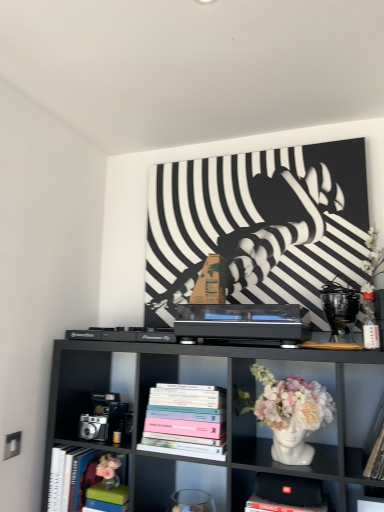
Question: Considering the relative positions of hardcover book at left, positioned as the first book in bottom-to-top order, and white glossy vase at center in the image provided, is hardcover book at left, positioned as the first book in bottom-to-top order, to the right of white glossy vase at center from the viewer's perspective?

Choices:
 (A) no
 (B) yes

Answer: (A)

Question: From a real-world perspective, is hardcover book at left, positioned as the first book in bottom-to-top order, located higher than white glossy vase at center?

Choices:
 (A) no
 (B) yes

Answer: (A)

Question: Does hardcover book at left, placed as the 1th book when sorted from left to right, touch white glossy vase at center?

Choices:
 (A) yes
 (B) no

Answer: (B)

Question: Is hardcover book at left, positioned as the first book in bottom-to-top order, at the left side of white glossy vase at center?

Choices:
 (A) no
 (B) yes

Answer: (B)

Question: Considering the relative sizes of hardcover book at left, the second book in the top-to-bottom sequence, and white glossy vase at center in the image provided, is hardcover book at left, the second book in the top-to-bottom sequence, smaller than white glossy vase at center?

Choices:
 (A) yes
 (B) no

Answer: (A)

Question: Would you consider hardcover book at left, the second book in the top-to-bottom sequence, to be distant from white glossy vase at center?

Choices:
 (A) no
 (B) yes

Answer: (A)

Question: From a real-world perspective, is hardcover book at left, the second book in the top-to-bottom sequence, located beneath black fabric speaker at lower center, which is counted as the first shelf, starting from the bottom?

Choices:
 (A) no
 (B) yes

Answer: (A)

Question: Is hardcover book at left, the second book in the top-to-bottom sequence, looking in the opposite direction of black fabric speaker at lower center, which ranks as the 2th shelf in top-to-bottom order?

Choices:
 (A) no
 (B) yes

Answer: (A)

Question: Does hardcover book at left, placed as the 1th book when sorted from left to right, appear on the left side of black fabric speaker at lower center, which ranks as the 2th shelf in top-to-bottom order?

Choices:
 (A) no
 (B) yes

Answer: (B)

Question: Is hardcover book at left, placed as the 1th book when sorted from left to right, wider than black fabric speaker at lower center, which ranks as the 2th shelf in top-to-bottom order?

Choices:
 (A) yes
 (B) no

Answer: (B)

Question: From the image's perspective, is hardcover book at left, the second book in the top-to-bottom sequence, on black fabric speaker at lower center, which is counted as the first shelf, starting from the bottom?

Choices:
 (A) yes
 (B) no

Answer: (B)

Question: Does hardcover book at left, placed as the 1th book when sorted from left to right, lie in front of black fabric speaker at lower center, which ranks as the 2th shelf in top-to-bottom order?

Choices:
 (A) no
 (B) yes

Answer: (A)

Question: Could hardcover books at center, placed as the 1th book when sorted from right to left, be considered to be inside black fabric speaker at lower center, which ranks as the 2th shelf in top-to-bottom order?

Choices:
 (A) yes
 (B) no

Answer: (B)